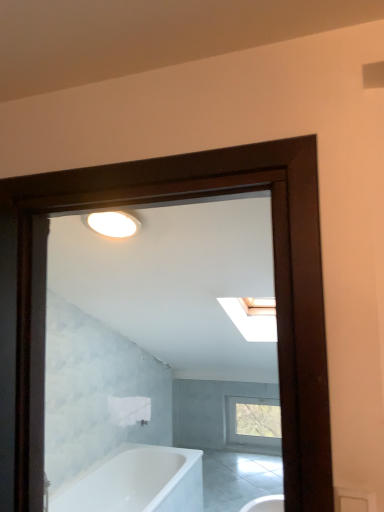
Question: Is white glossy bathtub at lower left in front of or behind clear glass window at center in the image?

Choices:
 (A) behind
 (B) front

Answer: (B)

Question: Looking at their shapes, would you say white glossy bathtub at lower left is wider or thinner than clear glass window at center?

Choices:
 (A) wide
 (B) thin

Answer: (A)

Question: Considering the positions of white glossy bathtub at lower left and clear glass window at center in the image, is white glossy bathtub at lower left bigger or smaller than clear glass window at center?

Choices:
 (A) big
 (B) small

Answer: (A)

Question: Looking at their shapes, would you say clear glass window at center is wider or thinner than white glossy bathtub at lower left?

Choices:
 (A) wide
 (B) thin

Answer: (B)

Question: Is point (x=271, y=425) positioned closer to the camera than point (x=140, y=476)?

Choices:
 (A) farther
 (B) closer

Answer: (A)

Question: From a real-world perspective, is clear glass window at center physically located above or below white glossy bathtub at lower left?

Choices:
 (A) below
 (B) above

Answer: (B)

Question: Considering the relative positions of clear glass window at center and white glossy bathtub at lower left in the image provided, is clear glass window at center to the left or to the right of white glossy bathtub at lower left?

Choices:
 (A) right
 (B) left

Answer: (A)